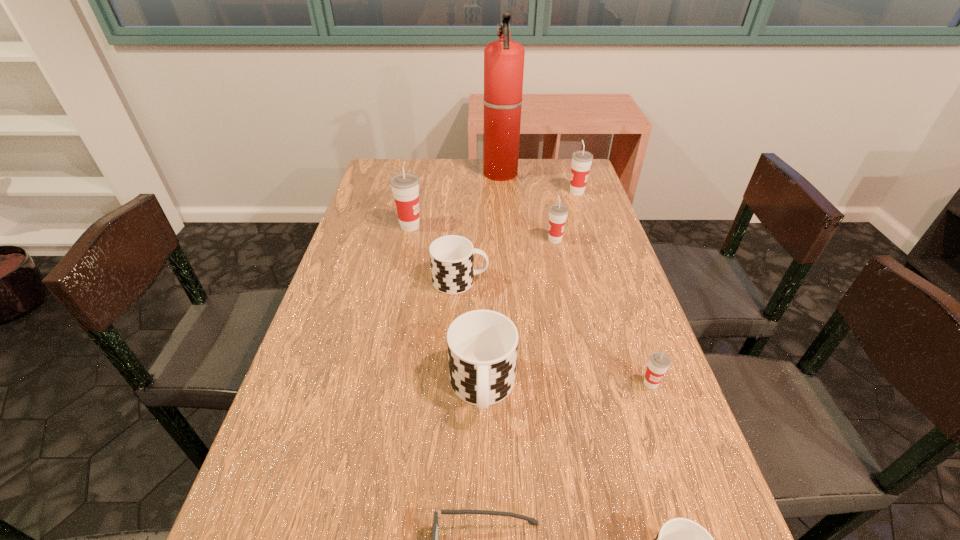
What are the coordinates of `free region located on the side of the fourth object from right to left with the logo` in the screenshot? It's located at (442, 240).

The width and height of the screenshot is (960, 540). Find the location of `free space located 0.050m on the side of the fourth object from right to left with the logo`. free space located 0.050m on the side of the fourth object from right to left with the logo is located at coordinates (528, 240).

Where is `blank space located 0.050m on the side of the biggest black cup with the handle`? This screenshot has width=960, height=540. blank space located 0.050m on the side of the biggest black cup with the handle is located at coordinates (483, 454).

You are a GUI agent. You are given a task and a screenshot of the screen. Output one action in this format:
    pyautogui.click(x=<x>, y=<y>)
    Task: Click on the vacant space situated on the side of the smallest red cup with the logo
    The height and width of the screenshot is (540, 960).
    Given the screenshot: What is the action you would take?
    pyautogui.click(x=686, y=488)

Where is `vacant position located on the side of the fifth nearest object with the handle`? The width and height of the screenshot is (960, 540). vacant position located on the side of the fifth nearest object with the handle is located at coordinates (554, 281).

Locate an element on the screen. Image resolution: width=960 pixels, height=540 pixels. fire extinguisher situated at the far edge is located at coordinates (503, 59).

The height and width of the screenshot is (540, 960). In order to click on cup present at the far edge in this screenshot , I will do 581,160.

Find the location of a particular element. The image size is (960, 540). object situated at the left edge is located at coordinates (405, 186).

The height and width of the screenshot is (540, 960). Identify the location of object that is positioned at the far right corner. (581, 160).

In the image, there is a desktop. Identify the location of vacant space at the far edge. This screenshot has height=540, width=960. tap(521, 174).